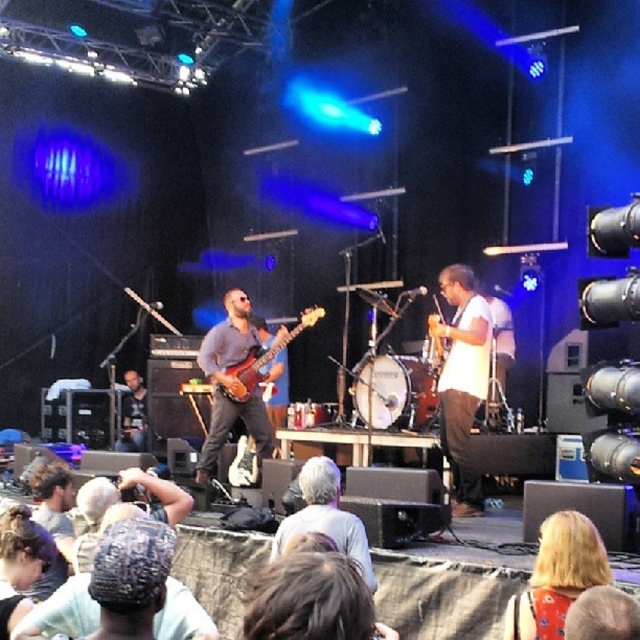
You are a stagehand setting up for a concert. You need to adjust the microphones so they are positioned at the same height as the white matte guitar at center and the matte brown guitar at center. Which guitar requires the microphone to be placed higher?

The white matte guitar at center requires the microphone to be placed higher because it is positioned above the matte brown guitar at center.

You are a stagehand who needs to place a new microphone stand between the white matte guitar at center and the matte brown guitar at center. Based on their sizes, which guitar should the microphone stand be closer to?

The white matte guitar at center is taller than the matte brown guitar at center, so the microphone stand should be placed closer to the shorter matte brown guitar at center to ensure visibility and accessibility for the performers.